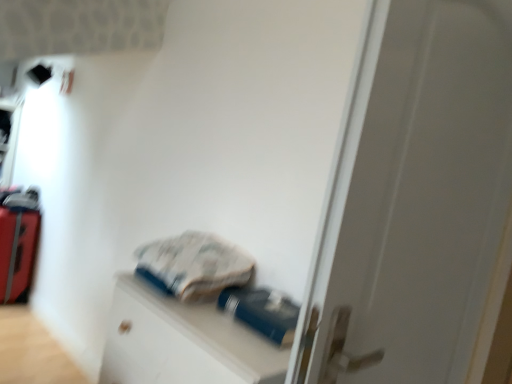
Question: Is blue matte file cabinet at center to the right of red suitcase at left from the viewer's perspective?

Choices:
 (A) no
 (B) yes

Answer: (B)

Question: From a real-world perspective, is blue matte file cabinet at center on red suitcase at left?

Choices:
 (A) no
 (B) yes

Answer: (B)

Question: Is blue matte file cabinet at center not inside red suitcase at left?

Choices:
 (A) no
 (B) yes

Answer: (B)

Question: Is red suitcase at left surrounded by blue matte file cabinet at center?

Choices:
 (A) yes
 (B) no

Answer: (B)

Question: Is blue matte file cabinet at center to the left of red suitcase at left from the viewer's perspective?

Choices:
 (A) no
 (B) yes

Answer: (A)

Question: From the image's perspective, is blue matte file cabinet at center located beneath red suitcase at left?

Choices:
 (A) yes
 (B) no

Answer: (A)

Question: From the image's perspective, is red suitcase at left on white matte door at center?

Choices:
 (A) no
 (B) yes

Answer: (A)

Question: From a real-world perspective, is red suitcase at left beneath white matte door at center?

Choices:
 (A) no
 (B) yes

Answer: (B)

Question: Is red suitcase at left positioned far away from white matte door at center?

Choices:
 (A) yes
 (B) no

Answer: (A)

Question: Does red suitcase at left have a greater height compared to white matte door at center?

Choices:
 (A) no
 (B) yes

Answer: (A)

Question: Is red suitcase at left to the left of white matte door at center from the viewer's perspective?

Choices:
 (A) no
 (B) yes

Answer: (B)

Question: Does red suitcase at left come in front of white matte door at center?

Choices:
 (A) no
 (B) yes

Answer: (A)

Question: Considering the relative sizes of red suitcase at left and blue rubberized bottle at center in the image provided, is red suitcase at left shorter than blue rubberized bottle at center?

Choices:
 (A) no
 (B) yes

Answer: (A)